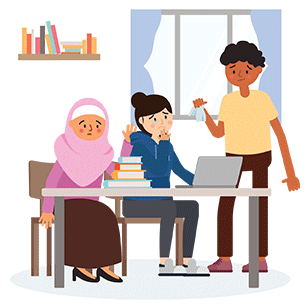
Find the location of a particular element. The width and height of the screenshot is (306, 306). wood shelf is located at coordinates (40, 56).